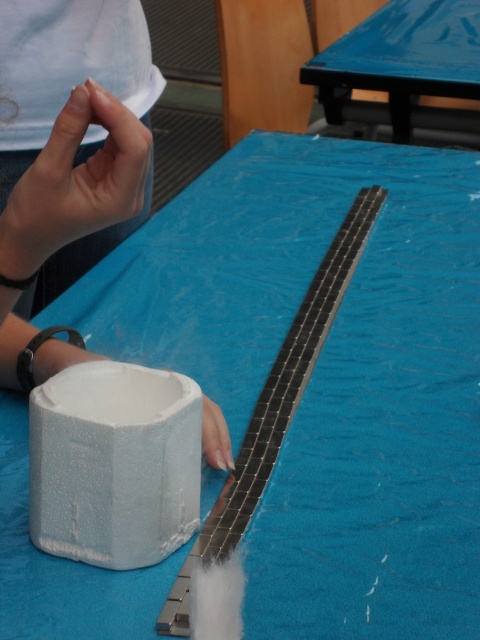
You are a lab assistant who needs to place a new equipment on the table. The equipment requires a surface area larger than the white matte foam cup at lower left. Can the blue plastic table at upper center accommodate it?

The blue plastic table at upper center can accommodate the equipment because the white matte foam cup at lower left occupies less space than the blue plastic table at upper center, indicating the table has sufficient surface area.

You are a lab assistant who needs to place the white matte foam cup at lower left onto the blue plastic table at upper center. Can you do this without moving your feet, given that your maximum reach is 3 feet?

The white matte foam cup at lower left and blue plastic table at upper center are 3.47 feet apart from each other. Since your maximum reach is only 3 feet, you cannot reach the blue plastic table at upper center from the white matte foam cup at lower left without moving your feet.

You are observing an experiment setup in a lab. There are two points marked in the image. The first point is at coordinates point [152,97] and the second point is at point [425,51]. From your perspective, which point is closer to you?

Point [152,97] is closer to the viewer than point [425,51].